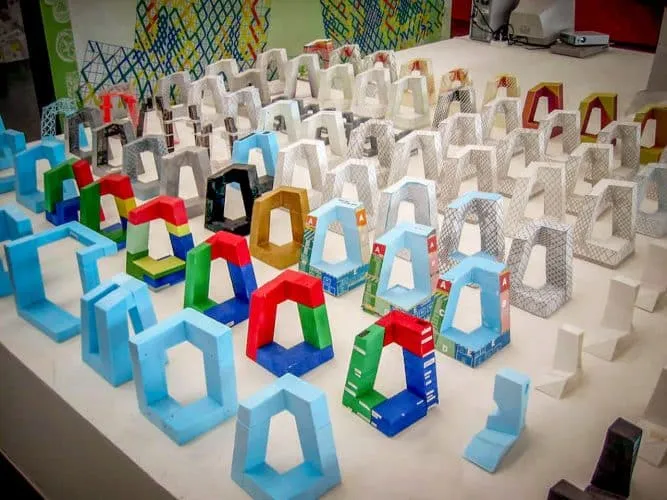
Identify the location of floor. (11, 486).